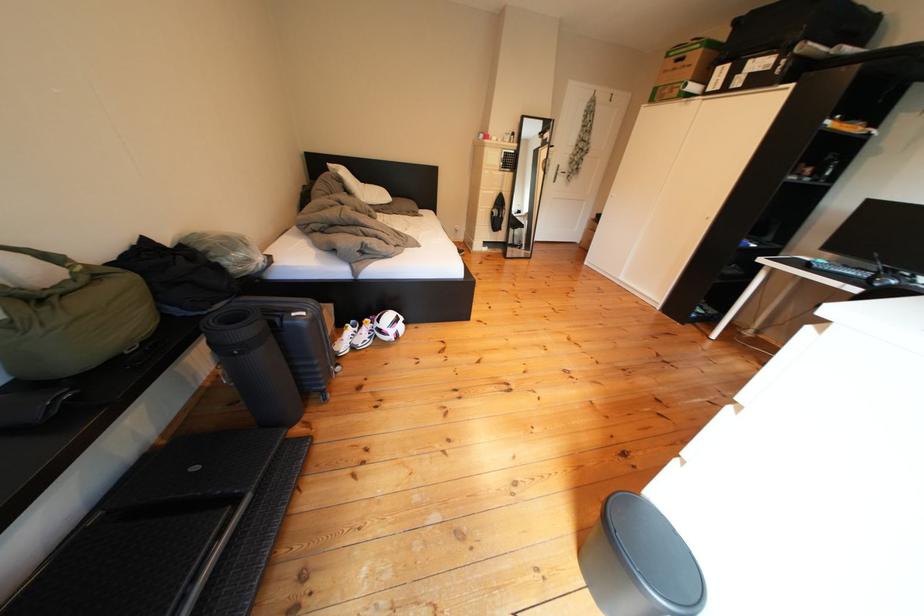
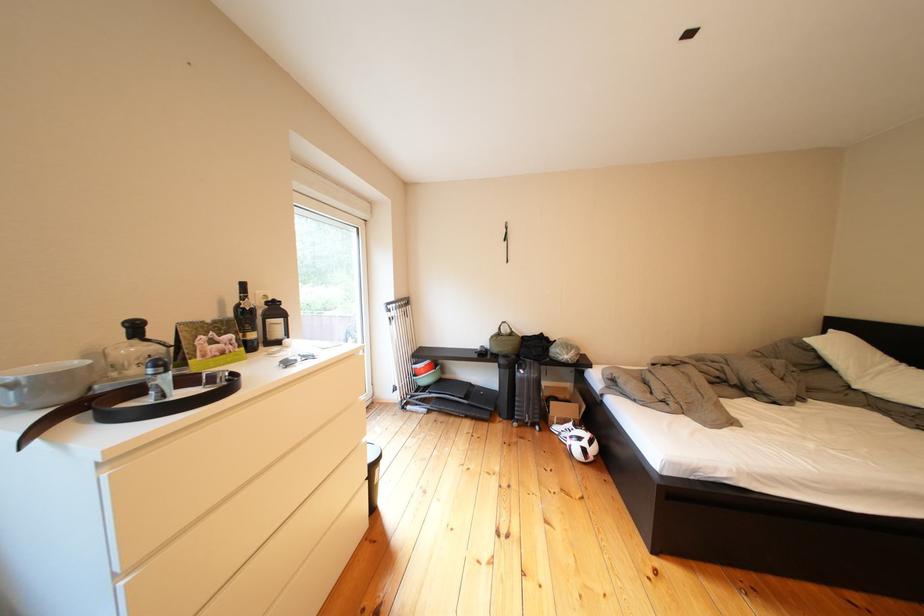
Locate, in the second image, the point that corresponds to (x=357, y=353) in the first image.

(570, 432)